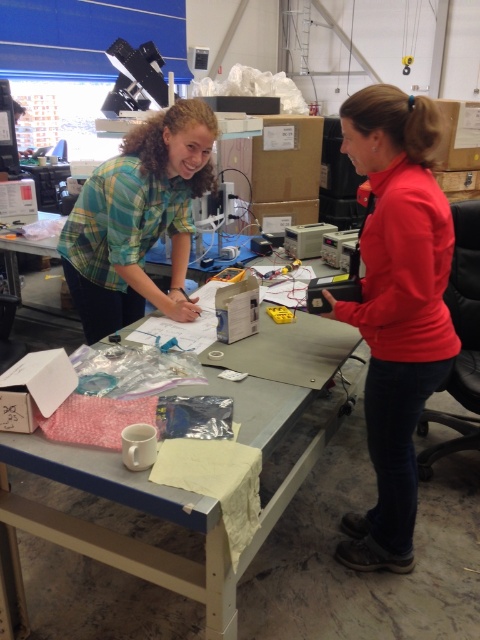
You are a worker in the workshop and need to place a new tool on the table. Considering the red matte shirt at right and the metallic gray table at center, which object is more suitable for placing the tool?

The metallic gray table at center is more suitable for placing the tool because it is larger than the red matte shirt at right.

You are organizing a clothing donation drive and need to sort shirts based on their positions. Which shirt, the red matte shirt at right or the green plaid shirt at upper left, is located more to the right side of the image?

The red matte shirt at right is positioned on the right side of the green plaid shirt at upper left, so it is located more to the right side of the image.